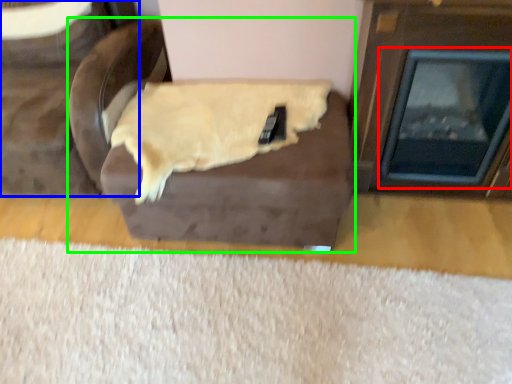
Question: Based on their relative distances, which object is farther from fireplace (highlighted by a red box)? Choose from furniture (highlighted by a blue box) and furniture (highlighted by a green box).

Choices:
 (A) furniture
 (B) furniture

Answer: (A)